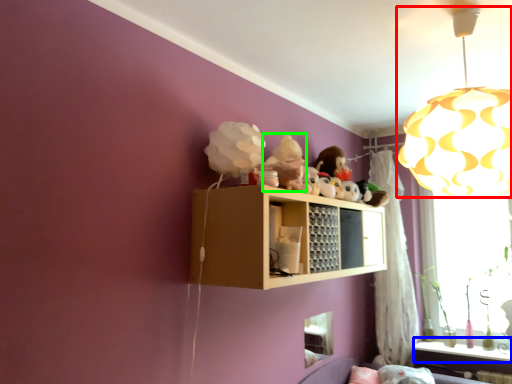
Question: Estimate the real-world distances between objects in this image. Which object is closer to lamp (highlighted by a red box), window sill (highlighted by a blue box) or figurine (highlighted by a green box)?

Choices:
 (A) window sill
 (B) figurine

Answer: (B)